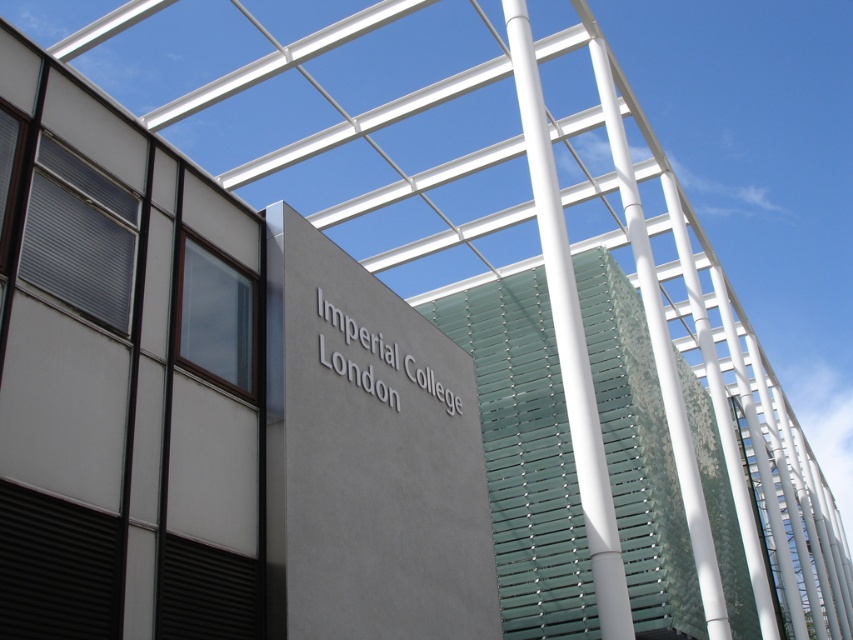
You are a drone operator trying to deliver a package to the gray concrete sign at center. Your drone is currently at point (367, 456). Is the gray concrete sign at center directly below your current position?

The gray concrete sign at center is located at point (367, 456), so yes, the gray concrete sign at center is directly below your current position.

You are a photographer planning to capture the gray concrete sign at center and the brown matte shutter at upper left in a single frame. Based on their sizes, which object should you focus on first to ensure both are clearly visible in the photo?

The gray concrete sign at center is smaller than the brown matte shutter at upper left, so you should focus on the brown matte shutter at upper left first to ensure both are clearly visible in the photo.